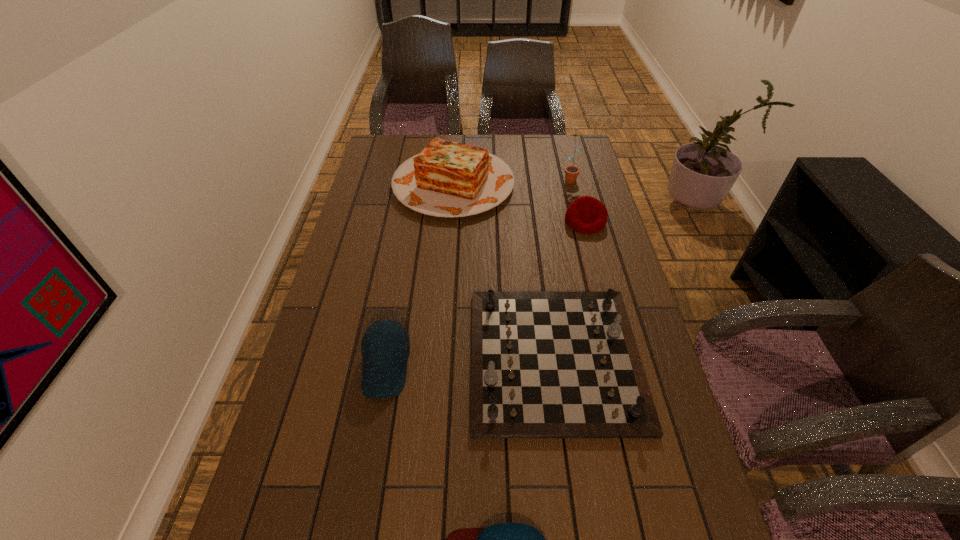
This screenshot has height=540, width=960. In order to click on sunflower in this screenshot , I will do `click(571, 172)`.

At what (x,y) coordinates should I click in order to perform the action: click on the fifth shortest object. Please return your answer as a coordinate pair (x, y). Looking at the image, I should click on [449, 179].

Locate an element on the screen. The height and width of the screenshot is (540, 960). the left baseball cap is located at coordinates (385, 346).

This screenshot has height=540, width=960. What are the coordinates of `the taller baseball cap` in the screenshot? It's located at (385, 346).

You are a GUI agent. You are given a task and a screenshot of the screen. Output one action in this format:
    pyautogui.click(x=<x>, y=<y>)
    Task: Click on the chessboard
    This screenshot has height=540, width=960.
    Given the screenshot: What is the action you would take?
    pyautogui.click(x=544, y=364)

Identify the location of beanbag. This screenshot has height=540, width=960. (587, 215).

This screenshot has height=540, width=960. Identify the location of free region located 0.180m on the flower of the tallest object. (579, 214).

This screenshot has height=540, width=960. Identify the location of vacant space located 0.160m on the right of the fifth shortest object. (556, 184).

You are a GUI agent. You are given a task and a screenshot of the screen. Output one action in this format:
    pyautogui.click(x=<x>, y=<y>)
    Task: Click on the vacant space located 0.230m on the front-facing side of the taller baseball cap
    
    Given the screenshot: What is the action you would take?
    pyautogui.click(x=363, y=504)

The width and height of the screenshot is (960, 540). I want to click on free region located on the board of the chessboard, so click(360, 358).